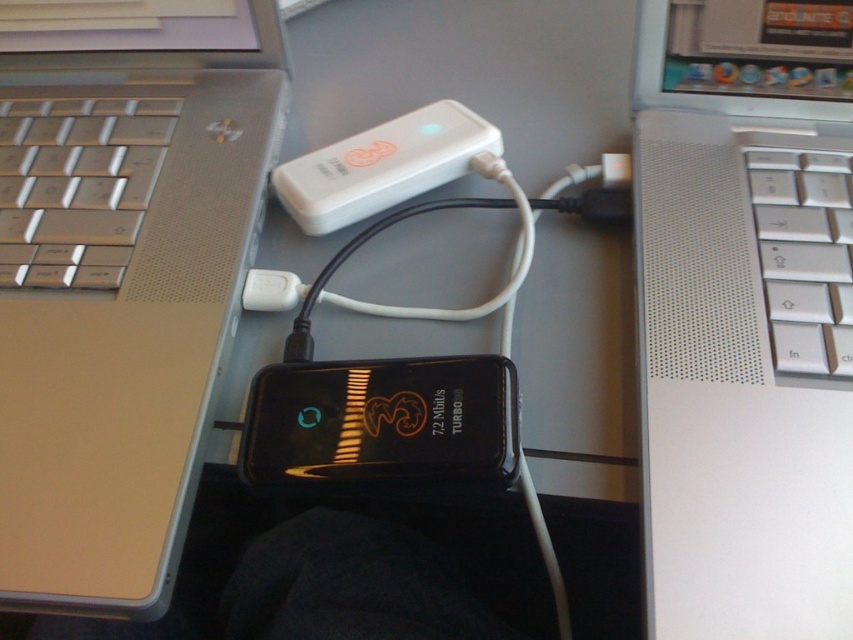
You are setting up a workspace and need to place the silver metallic keyboard at right and the white matte usb device at center on a desk. If the desk has limited space, which object should you prioritize placing first to ensure both fit?

The silver metallic keyboard at right has a smaller size compared to the white matte usb device at center. Therefore, you should place the larger white matte usb device at center first to accommodate its size, then fit the smaller keyboard next to it.